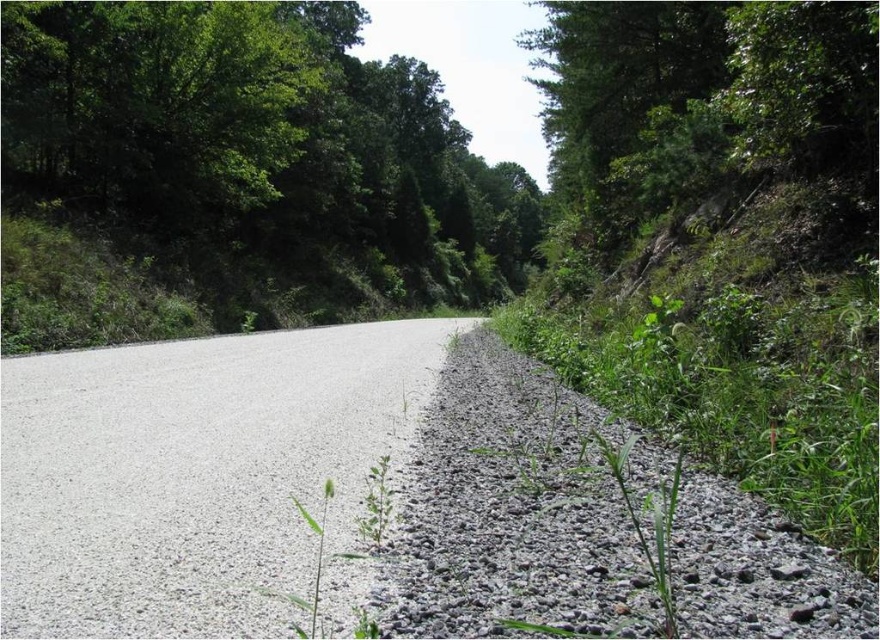
Who is higher up, green leafy tree at upper center or green grassy weed at center?

green leafy tree at upper center is above.

Between point (254, 49) and point (622, 445), which one is positioned behind?

Point (254, 49)

Is point (116, 205) less distant than point (627, 502)?

No, it is behind (627, 502).

Identify the location of green leafy tree at upper center. This screenshot has height=640, width=880. [259, 150].

I want to click on gray gravel at right, so click(518, 509).

Consider the image. Who is more distant from viewer, (413, 621) or (386, 520)?

Positioned behind is point (386, 520).

Identify the location of gray gravel at right. The height and width of the screenshot is (640, 880). (518, 509).

You are a GUI agent. You are given a task and a screenshot of the screen. Output one action in this format:
    pyautogui.click(x=<x>, y=<y>)
    Task: Click on the gray asphalt road at center
    
    Given the screenshot: What is the action you would take?
    pyautogui.click(x=194, y=474)

Does point (106, 554) lie in front of point (370, 529)?

Yes.

Where is `gray asphalt road at center`? gray asphalt road at center is located at coordinates (194, 474).